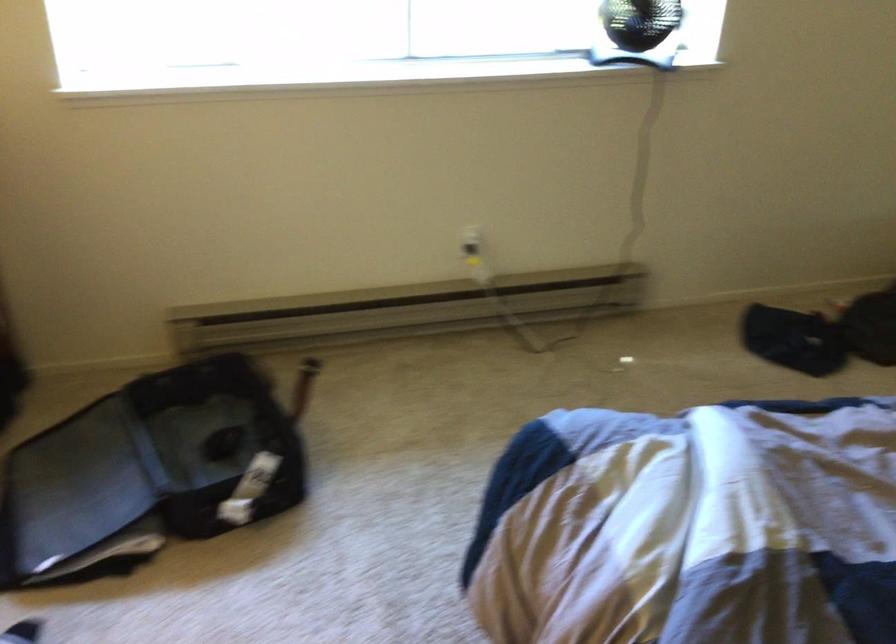
First-person continuous shooting, in which direction is the camera rotating?

The camera rotated toward right-down.